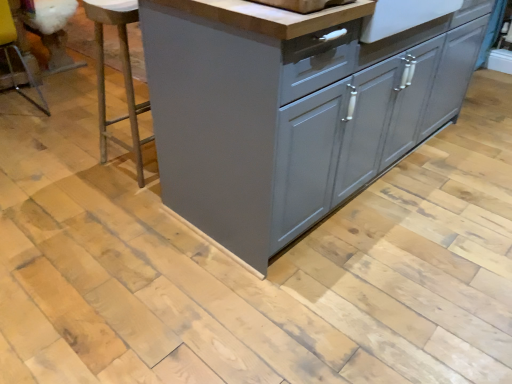
I want to click on free location to the right of clear plastic bar stool at left, the second bar stool viewed from the right, so click(64, 115).